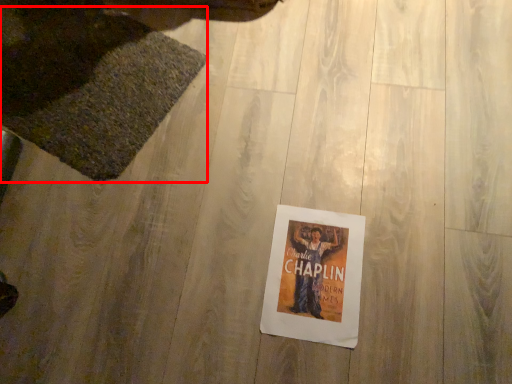
Question: From the image's perspective, considering the relative positions of mat (annotated by the red box) and poster in the image provided, where is mat (annotated by the red box) located with respect to the staircase?

Choices:
 (A) below
 (B) above

Answer: (B)